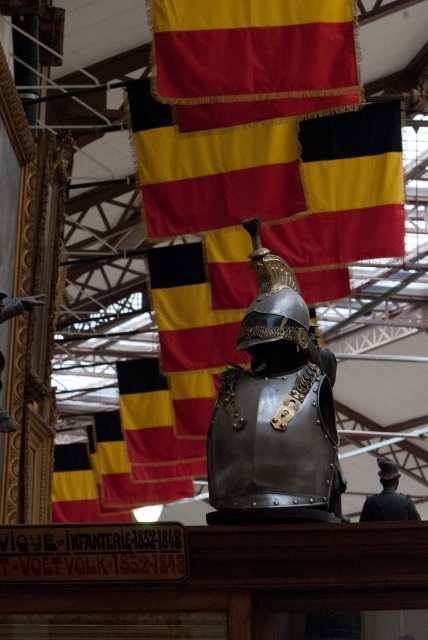
Question: Which point is closer to the camera?

Choices:
 (A) (61, 460)
 (B) (356, 136)

Answer: (B)

Question: Which point is farther from the camera taking this photo?

Choices:
 (A) (415, 506)
 (B) (246, 314)
 (C) (291, 163)
 (D) (121, 488)

Answer: (D)

Question: Where is yellow/red/black fabric at center located in relation to black and yellow fabric flag at center in the image?

Choices:
 (A) right
 (B) left

Answer: (A)

Question: Is yellow/red/black fabric at center below red fabric flag at upper center?

Choices:
 (A) no
 (B) yes

Answer: (B)

Question: Which point is farther to the camera?

Choices:
 (A) (240, 348)
 (B) (287, 289)

Answer: (B)

Question: Is shiny metallic armor at center wider than yellow-black checkered fabric at center?

Choices:
 (A) yes
 (B) no

Answer: (B)